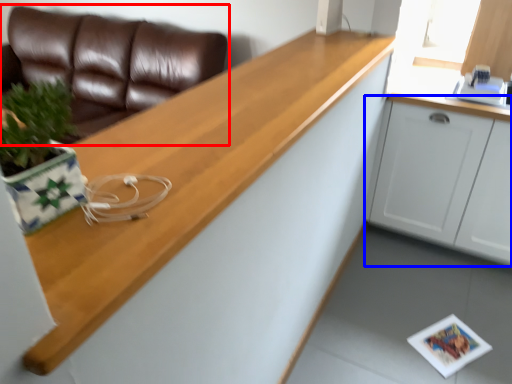
Question: Among these objects, which one is farthest to the camera, studio couch (highlighted by a red box) or cabinetry (highlighted by a blue box)?

Choices:
 (A) studio couch
 (B) cabinetry

Answer: (A)